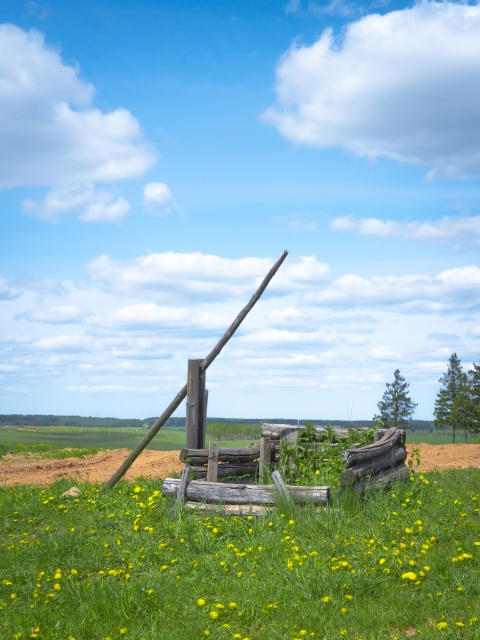
Locate an element on the screen. This screenshot has height=640, width=480. weathered wood fence at center is located at coordinates (229, 474).

Which is in front, point (179, 563) or point (115, 470)?

Point (179, 563)

Which of these two, yellow grass at center or rustic wooden pole at center, stands taller?

Standing taller between the two is rustic wooden pole at center.

Is point (474, 634) less distant than point (235, 317)?

Yes, it is.

This screenshot has height=640, width=480. Identify the location of yellow grass at center. (241, 564).

Which is more to the left, yellow grass at center or weathered wood fence at center?

yellow grass at center is more to the left.

How much distance is there between yellow grass at center and weathered wood fence at center?

yellow grass at center is 3.46 feet away from weathered wood fence at center.

Does point (84, 564) come closer to viewer compared to point (249, 468)?

Yes, it is in front of point (249, 468).

Identify the location of yellow grass at center. (241, 564).